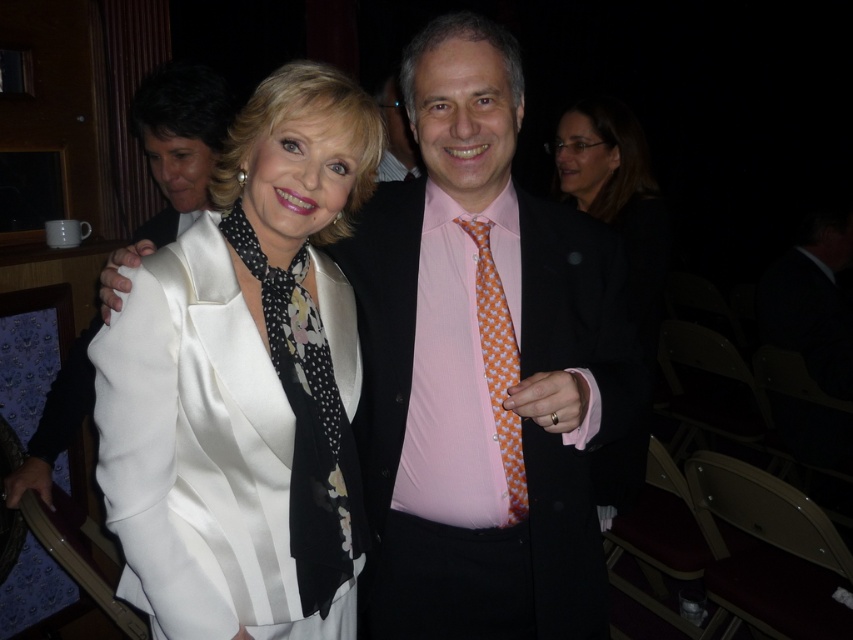
You are a photographer setting up for a group photo. You notice the matte black suit at center is positioned at coordinates 0.623 on the x and 0.706 on the y. If you want to frame the scene so the suit is centered in your camera view, should you adjust your camera position to the left or right?

The matte black suit at center is already at the specified coordinates. Since the question mentions it is at center, no adjustment is needed. However, if the camera view requires perfect centering at those coordinates, no left or right adjustment is necessary as it is already positioned there.

You are a photographer adjusting camera settings for a group photo. You notice the satin white suit at center and the matte black jacket at upper right. Which object should you focus on first if you want to capture both in sharp focus, considering their sizes?

The satin white suit at center is much taller than the matte black jacket at upper right, so focusing on the larger object first would ensure better depth of field coverage for both.

You are organizing a photo shoot and need to adjust the lighting between the satin white suit at center and the matte black jacket at upper right. Since the two items are 3.73 feet apart, what is the minimum distance your lighting equipment must cover to ensure both are properly lit?

The minimum distance the lighting equipment must cover is 3.73 feet to ensure both the satin white suit at center and the matte black jacket at upper right are properly lit.